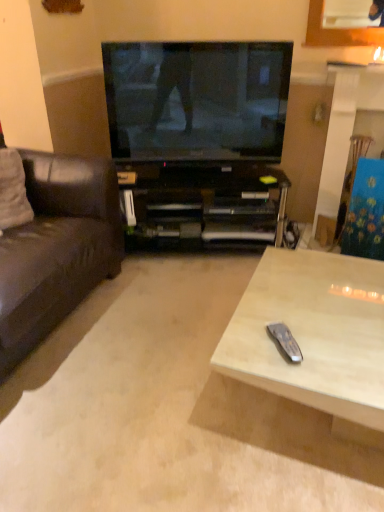
You are a GUI agent. You are given a task and a screenshot of the screen. Output one action in this format:
    pyautogui.click(x=<x>, y=<y>)
    Task: Click on the vacant area on the back side of silver metallic remote at lower right
    
    Given the screenshot: What is the action you would take?
    pyautogui.click(x=278, y=316)